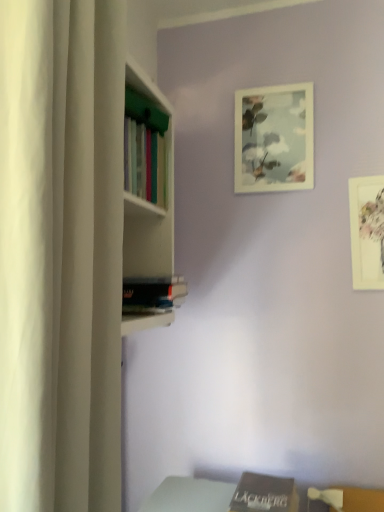
What are the coordinates of `free point above brown matte book at lower center, the first book when ordered from bottom to top (from a real-world perspective)` in the screenshot? It's located at (263, 485).